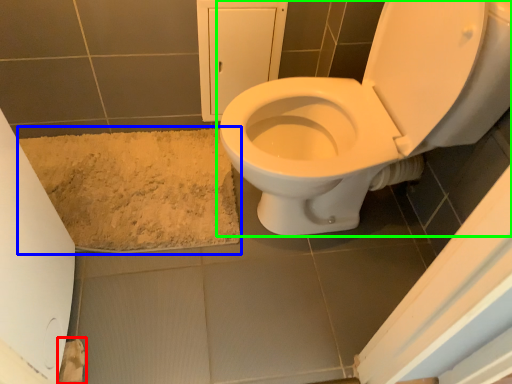
Question: Which object is positioned farthest from toilet paper (highlighted by a red box)? Select from bath mat (highlighted by a blue box) and toilet (highlighted by a green box).

Choices:
 (A) bath mat
 (B) toilet

Answer: (B)